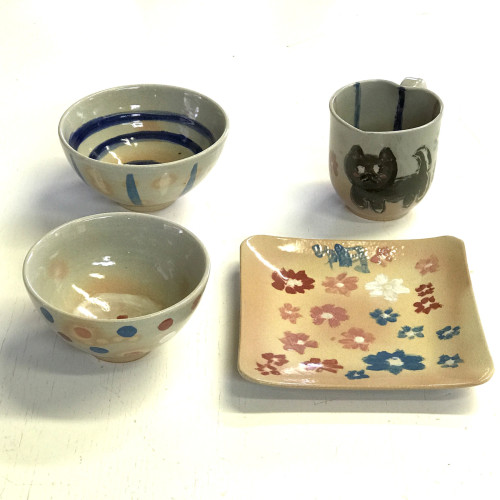
You are a GUI agent. You are given a task and a screenshot of the screen. Output one action in this format:
    pyautogui.click(x=<x>, y=<y>)
    Task: Click on the bowl
    
    Given the screenshot: What is the action you would take?
    pyautogui.click(x=102, y=273), pyautogui.click(x=144, y=122)